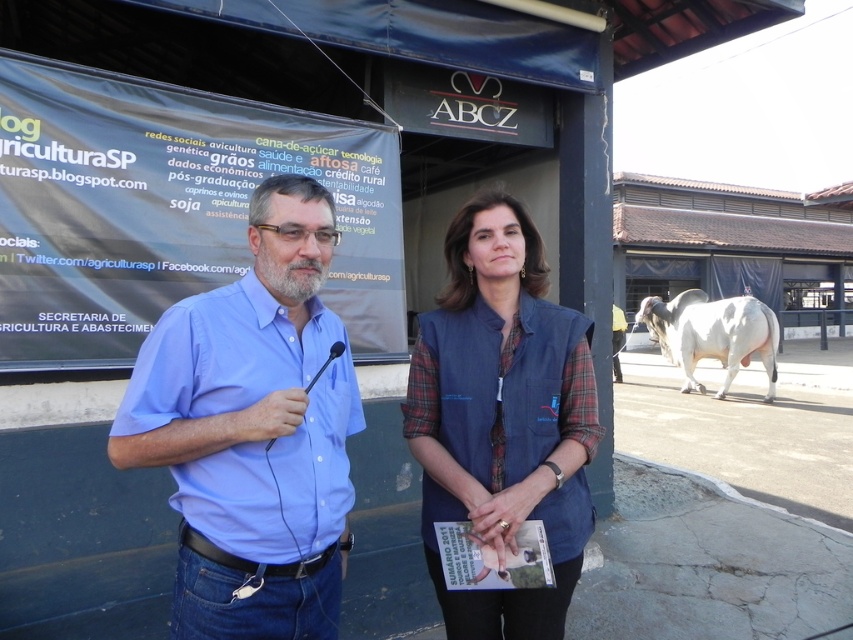
You are a photographer trying to capture both the denim vest at center and the white smooth bull at right in a single frame. Based on their heights, which object should you focus on to ensure both are fully visible in the photo?

The denim vest at center is taller than the white smooth bull at right. To ensure both are fully visible, focus on the denim vest at center as it requires more vertical space due to its greater height.

Based on the photo, you are a photographer at this event and want to capture both the blue shirt at left and the white smooth bull at right in the same frame. Based on their positions, can you tell which one is higher in the image?

The blue shirt at left is above the white smooth bull at right in the image.